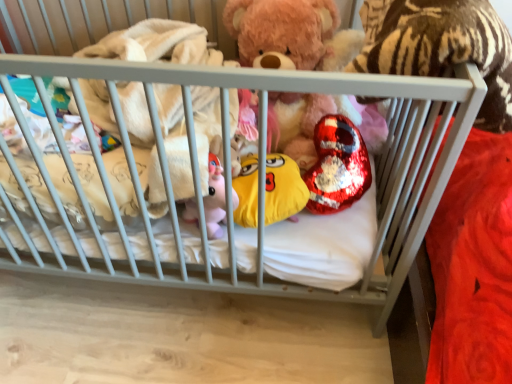
Question: From the image's perspective, is shiny sequined heart at center, arranged as the 2th toy when viewed from the left, under yellow plush toy at center, the first toy when ordered from left to right?

Choices:
 (A) yes
 (B) no

Answer: (B)

Question: Considering the relative sizes of shiny sequined heart at center, which is the 1th toy in right-to-left order, and yellow plush toy at center, the first toy when ordered from left to right, in the image provided, is shiny sequined heart at center, which is the 1th toy in right-to-left order, bigger than yellow plush toy at center, the first toy when ordered from left to right,?

Choices:
 (A) yes
 (B) no

Answer: (A)

Question: Is shiny sequined heart at center, arranged as the 2th toy when viewed from the left, shorter than yellow plush toy at center, which is counted as the 2th toy, starting from the right?

Choices:
 (A) yes
 (B) no

Answer: (B)

Question: Is shiny sequined heart at center, arranged as the 2th toy when viewed from the left, outside of yellow plush toy at center, the first toy when ordered from left to right?

Choices:
 (A) no
 (B) yes

Answer: (B)

Question: From the image's perspective, is shiny sequined heart at center, which is the 1th toy in right-to-left order, on yellow plush toy at center, the first toy when ordered from left to right?

Choices:
 (A) yes
 (B) no

Answer: (A)

Question: Relative to shiny sequined heart at center, which is the 1th toy in right-to-left order, is yellow plush toy at center, which is counted as the 2th toy, starting from the right, in front or behind?

Choices:
 (A) front
 (B) behind

Answer: (A)

Question: In terms of width, does yellow plush toy at center, the first toy when ordered from left to right, look wider or thinner when compared to shiny sequined heart at center, arranged as the 2th toy when viewed from the left?

Choices:
 (A) wide
 (B) thin

Answer: (B)

Question: From the image's perspective, is yellow plush toy at center, the first toy when ordered from left to right, above or below shiny sequined heart at center, which is the 1th toy in right-to-left order?

Choices:
 (A) above
 (B) below

Answer: (B)

Question: Would you say yellow plush toy at center, which is counted as the 2th toy, starting from the right, is inside or outside shiny sequined heart at center, arranged as the 2th toy when viewed from the left?

Choices:
 (A) outside
 (B) inside

Answer: (A)

Question: Considering the positions of shiny sequined heart at center, arranged as the 2th toy when viewed from the left, and yellow plush toy at center, which is counted as the 2th toy, starting from the right, in the image, is shiny sequined heart at center, arranged as the 2th toy when viewed from the left, taller or shorter than yellow plush toy at center, which is counted as the 2th toy, starting from the right,?

Choices:
 (A) tall
 (B) short

Answer: (A)

Question: Does point (302, 175) appear closer or farther from the camera than point (282, 185)?

Choices:
 (A) closer
 (B) farther

Answer: (B)

Question: Which is correct: shiny sequined heart at center, arranged as the 2th toy when viewed from the left, is inside yellow plush toy at center, which is counted as the 2th toy, starting from the right, or outside of it?

Choices:
 (A) outside
 (B) inside

Answer: (A)

Question: From a real-world perspective, is shiny sequined heart at center, which is the 1th toy in right-to-left order, above or below yellow plush toy at center, the first toy when ordered from left to right?

Choices:
 (A) below
 (B) above

Answer: (B)

Question: In terms of width, does yellow plush toy at center, the first toy when ordered from left to right, look wider or thinner when compared to fluffy pink teddy bear at center?

Choices:
 (A) thin
 (B) wide

Answer: (A)

Question: Do you think yellow plush toy at center, which is counted as the 2th toy, starting from the right, is within fluffy pink teddy bear at center, or outside of it?

Choices:
 (A) outside
 (B) inside

Answer: (A)